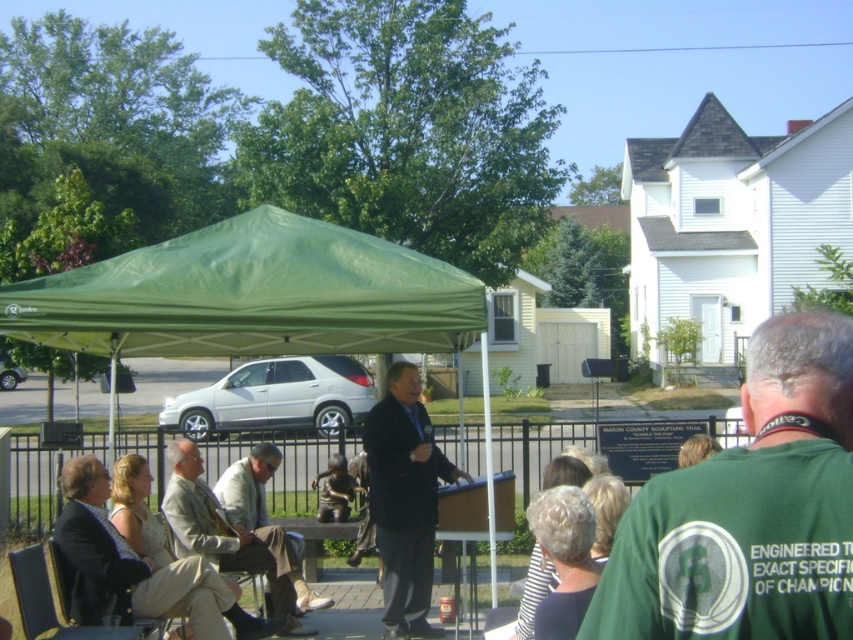
Between green fabric tent at center and dark blue suit at center, which one has more height?

dark blue suit at center is taller.

Can you confirm if green fabric tent at center is thinner than dark blue suit at center?

No.

Between point (210, 236) and point (412, 593), which one is positioned behind?

Point (412, 593)

Locate an element on the screen. green fabric tent at center is located at coordinates (252, 296).

Is the position of green fabric shirt at center less distant than that of green fabric tent at center?

Yes, it is in front of green fabric tent at center.

Which is in front, point (717, 573) or point (45, 324)?

Positioned in front is point (717, 573).

Locate an element on the screen. The image size is (853, 640). green fabric shirt at center is located at coordinates (749, 509).

Can you confirm if dark blue suit at center is smaller than light beige fabric pants at center?

Correct, dark blue suit at center occupies less space than light beige fabric pants at center.

Between dark blue suit at center and light beige fabric pants at center, which one appears on the left side from the viewer's perspective?

light beige fabric pants at center

You are a GUI agent. You are given a task and a screenshot of the screen. Output one action in this format:
    pyautogui.click(x=<x>, y=<y>)
    Task: Click on the dark blue suit at center
    
    Given the screenshot: What is the action you would take?
    click(404, 499)

This screenshot has height=640, width=853. Identify the location of dark blue suit at center. (404, 499).